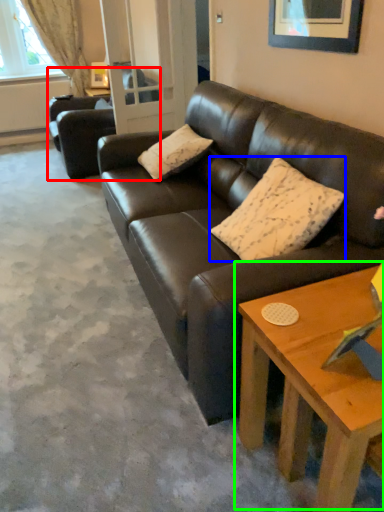
Question: Considering the real-world distances, which object is closest to studio couch (highlighted by a red box)? pillow (highlighted by a blue box) or coffee table (highlighted by a green box).

Choices:
 (A) pillow
 (B) coffee table

Answer: (A)